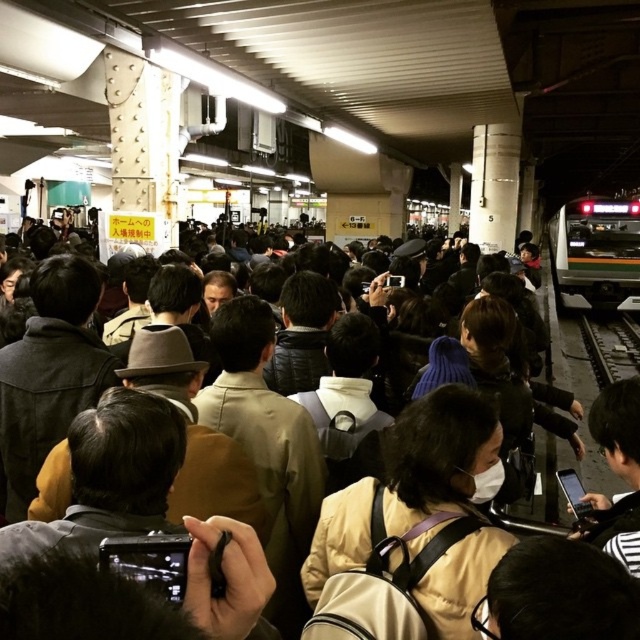
Can you confirm if green matte train at right is positioned to the right of black metal train track at right?

Indeed, green matte train at right is positioned on the right side of black metal train track at right.

What are the coordinates of `green matte train at right` in the screenshot? It's located at (595, 252).

Is beige fabric backpack at center further to the viewer compared to black metal train track at right?

That is False.

Does beige fabric backpack at center lie in front of black metal train track at right?

That is True.

At what (x,y) coordinates should I click in order to perform the action: click on beige fabric backpack at center. Please return your answer as a coordinate pair (x, y). This screenshot has height=640, width=640. Looking at the image, I should click on (412, 529).

Does beige fabric backpack at center have a lesser height compared to green matte train at right?

Indeed, beige fabric backpack at center has a lesser height compared to green matte train at right.

This screenshot has width=640, height=640. Find the location of `beige fabric backpack at center`. beige fabric backpack at center is located at coordinates (412, 529).